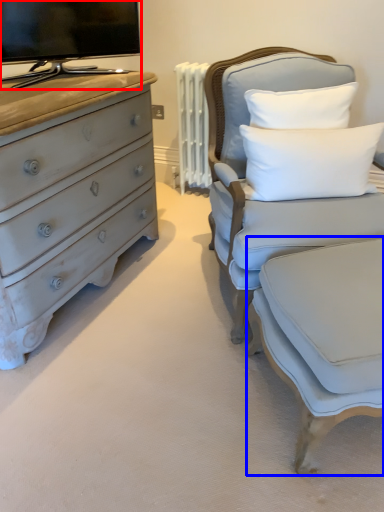
Question: Among these objects, which one is farthest to the camera, television (highlighted by a red box) or swivel chair (highlighted by a blue box)?

Choices:
 (A) television
 (B) swivel chair

Answer: (A)